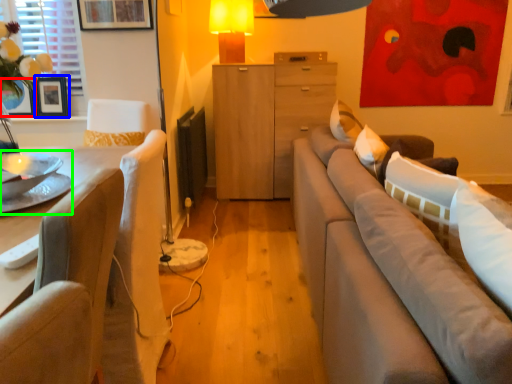
Question: Which object is positioned farthest from vase (highlighted by a red box)? Select from picture frame (highlighted by a blue box) and round table (highlighted by a green box).

Choices:
 (A) picture frame
 (B) round table

Answer: (B)